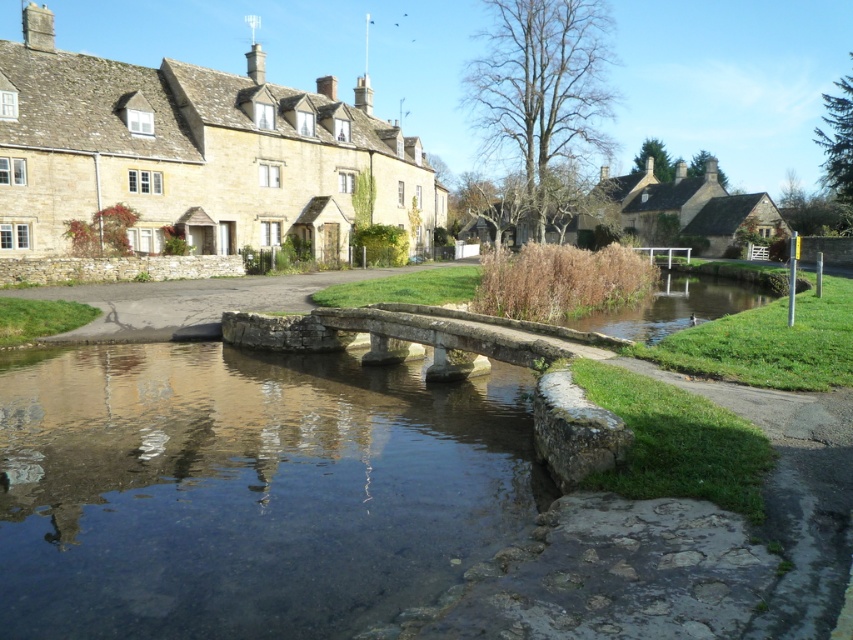
Question: Which object is positioned farthest from the clear stone water at center?

Choices:
 (A) matte stone house at center
 (B) stone village at upper left

Answer: (A)

Question: Which point is farther to the camera?

Choices:
 (A) clear stone water at center
 (B) stone village at upper left

Answer: (B)

Question: Can you confirm if clear stone water at center is positioned above matte stone house at center?

Choices:
 (A) yes
 (B) no

Answer: (B)

Question: Estimate the real-world distances between objects in this image. Which object is farther from the matte stone house at center?

Choices:
 (A) stone village at upper left
 (B) clear stone water at center

Answer: (B)

Question: Is clear stone water at center to the right of matte stone house at center from the viewer's perspective?

Choices:
 (A) yes
 (B) no

Answer: (B)

Question: Is clear stone water at center below stone village at upper left?

Choices:
 (A) no
 (B) yes

Answer: (B)